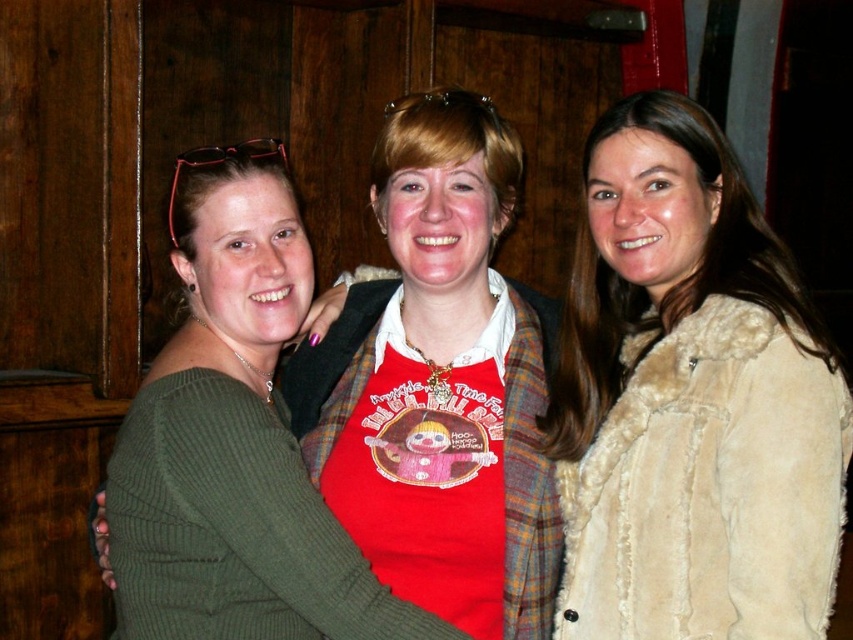
Who is positioned more to the left, beige furry coat at right or beige fur coat at right?

From the viewer's perspective, beige furry coat at right appears more on the left side.

Can you confirm if beige furry coat at right is thinner than beige fur coat at right?

Indeed, beige furry coat at right has a lesser width compared to beige fur coat at right.

Find the location of a particular element. Image resolution: width=853 pixels, height=640 pixels. beige furry coat at right is located at coordinates (709, 486).

Is point (412, 400) positioned behind point (567, 438)?

Yes.

Between point (425, 588) and point (653, 323), which one is positioned behind?

Positioned behind is point (653, 323).

Locate an element on the screen. This screenshot has width=853, height=640. red matte apron at center is located at coordinates (438, 384).

Can you confirm if red matte apron at center is smaller than beige furry coat at right?

Actually, red matte apron at center might be larger than beige furry coat at right.

Can you confirm if red matte apron at center is wider than beige furry coat at right?

Correct, the width of red matte apron at center exceeds that of beige furry coat at right.

This screenshot has height=640, width=853. What do you see at coordinates (438, 384) in the screenshot?
I see `red matte apron at center` at bounding box center [438, 384].

Locate an element on the screen. Image resolution: width=853 pixels, height=640 pixels. red matte apron at center is located at coordinates (438, 384).